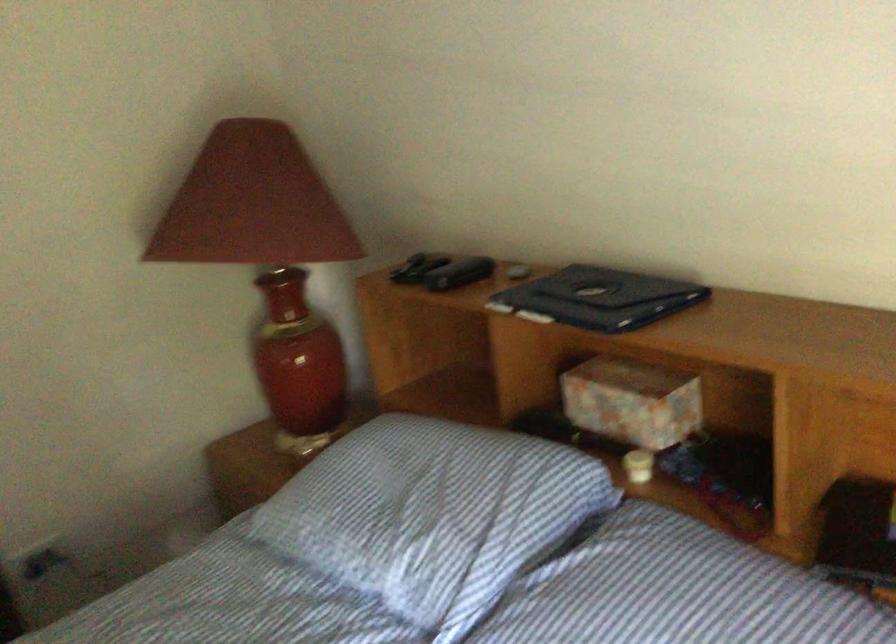
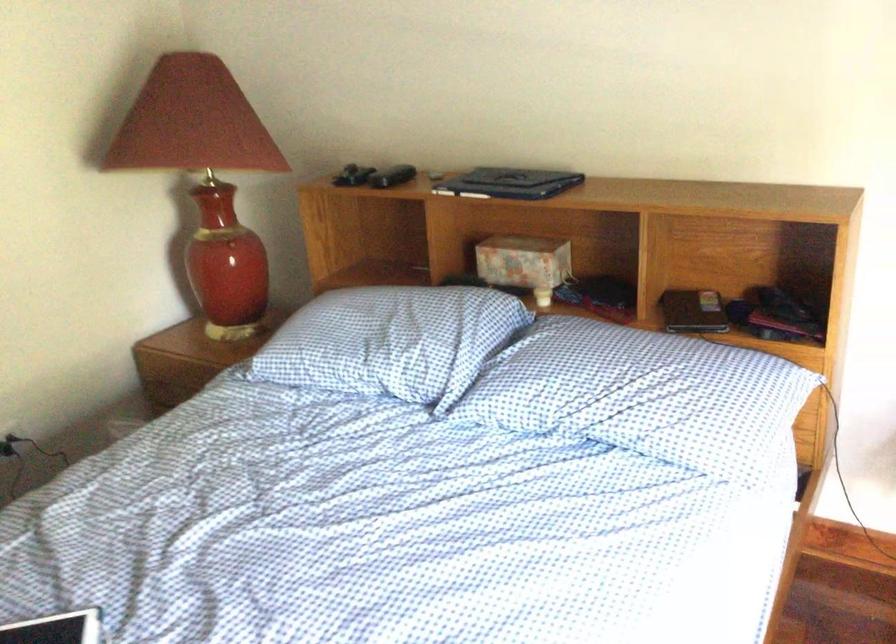
In the second image, find the point that corresponds to the point at 410,509 in the first image.

(384, 342)